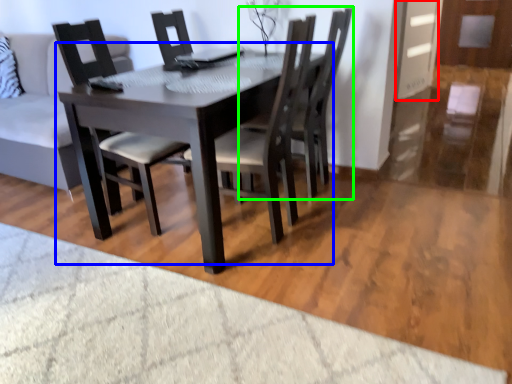
Question: Based on their relative distances, which object is farther from glass door (highlighted by a red box)? Choose from kitchen & dining room table (highlighted by a blue box) and chair (highlighted by a green box).

Choices:
 (A) kitchen & dining room table
 (B) chair

Answer: (A)